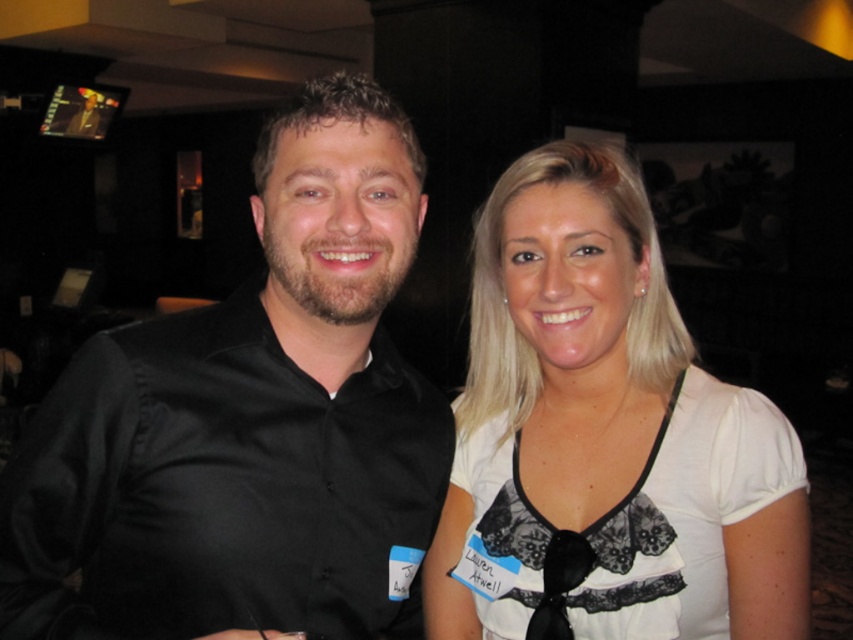
Can you confirm if white lace blouse at center is thinner than black satin tie at center?

Incorrect, white lace blouse at center's width is not less than black satin tie at center's.

Measure the distance from white lace blouse at center to black satin tie at center.

white lace blouse at center is 8.04 inches away from black satin tie at center.

Describe the element at coordinates (606, 433) in the screenshot. I see `white lace blouse at center` at that location.

Where is `white lace blouse at center`? The image size is (853, 640). white lace blouse at center is located at coordinates (606, 433).

Does point (387, 113) come farther from viewer compared to point (524, 637)?

No.

Between point (146, 580) and point (567, 589), which one is positioned behind?

Positioned behind is point (567, 589).

Identify the location of black satin shirt at left. (248, 424).

Between point (119, 381) and point (463, 524), which one is positioned in front?

Positioned in front is point (119, 381).

Can you confirm if black satin shirt at left is thinner than white lace blouse at center?

Incorrect, black satin shirt at left's width is not less than white lace blouse at center's.

Is point (302, 257) positioned after point (595, 636)?

No.

The image size is (853, 640). Identify the location of black satin shirt at left. (248, 424).